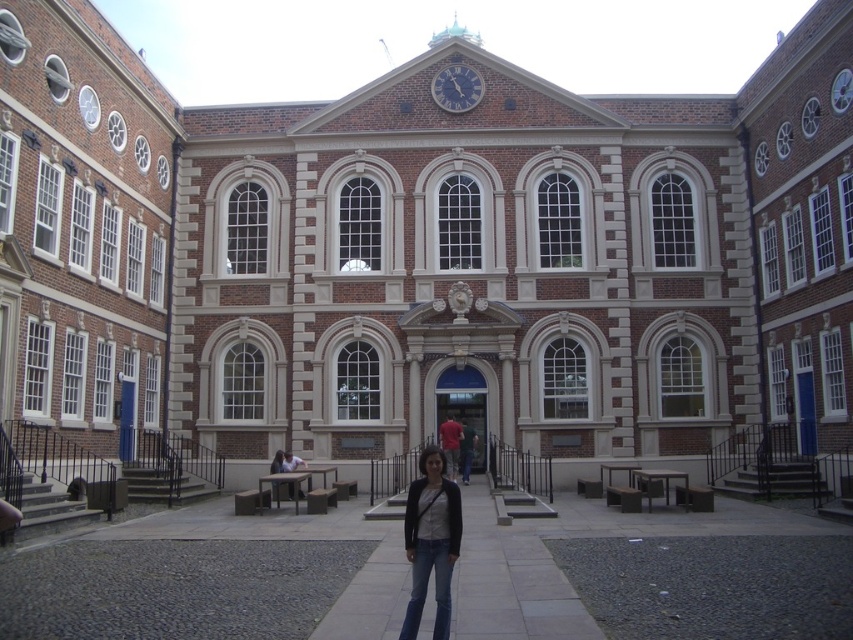
Does denim jeans at center have a lesser height compared to light brown wooden bench at center?

No.

Identify the location of denim jeans at center. (431, 541).

Which of these two, blue painted metal clock at upper center or light brown wooden bench at center, stands shorter?

Standing shorter between the two is blue painted metal clock at upper center.

I want to click on blue painted metal clock at upper center, so click(456, 88).

Describe the element at coordinates (456, 88) in the screenshot. I see `blue painted metal clock at upper center` at that location.

You are a GUI agent. You are given a task and a screenshot of the screen. Output one action in this format:
    pyautogui.click(x=<x>, y=<y>)
    Task: Click on the blue painted metal clock at upper center
    This screenshot has width=853, height=640.
    Given the screenshot: What is the action you would take?
    pyautogui.click(x=456, y=88)

Who is positioned more to the right, denim jeans at center or dark red shirt at center?

From the viewer's perspective, dark red shirt at center appears more on the right side.

Which is in front, point (425, 497) or point (465, 435)?

Point (425, 497) is more forward.

The image size is (853, 640). Find the location of `denim jeans at center`. denim jeans at center is located at coordinates (431, 541).